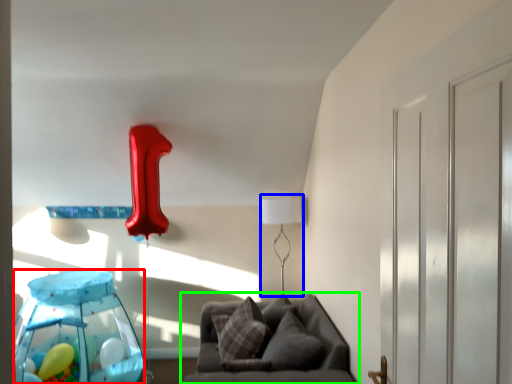
Question: Considering the real-world distances, which object is farthest from glass table (highlighted by a red box)? table lamp (highlighted by a blue box) or furniture (highlighted by a green box)?

Choices:
 (A) table lamp
 (B) furniture

Answer: (A)